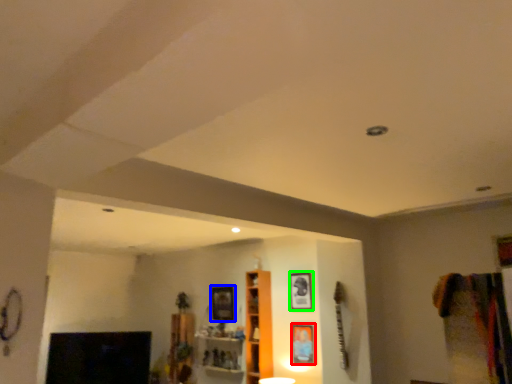
Question: Considering the real-world distances, which object is closest to picture frame (highlighted by a red box)? picture frame (highlighted by a blue box) or picture frame (highlighted by a green box).

Choices:
 (A) picture frame
 (B) picture frame

Answer: (B)